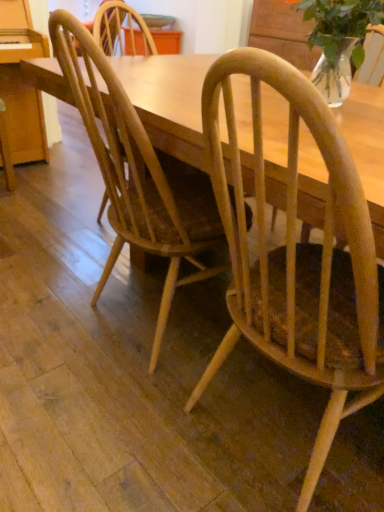
Question: Does natural wood chair at center, which is the 1th chair in left-to-right order, have a greater width compared to light brown wood chair at center, which appears as the 2th chair when viewed from the left?

Choices:
 (A) yes
 (B) no

Answer: (B)

Question: From the image's perspective, would you say natural wood chair at center, marked as the 2th chair in a right-to-left arrangement, is shown under light brown wood chair at center, which is counted as the first chair, starting from the right?

Choices:
 (A) no
 (B) yes

Answer: (A)

Question: Is natural wood chair at center, marked as the 2th chair in a right-to-left arrangement, not close to light brown wood chair at center, which is counted as the first chair, starting from the right?

Choices:
 (A) yes
 (B) no

Answer: (B)

Question: Considering the relative sizes of natural wood chair at center, which is the 1th chair in left-to-right order, and light brown wood chair at center, which is counted as the first chair, starting from the right, in the image provided, is natural wood chair at center, which is the 1th chair in left-to-right order, shorter than light brown wood chair at center, which is counted as the first chair, starting from the right,?

Choices:
 (A) yes
 (B) no

Answer: (A)

Question: Considering the relative positions of natural wood chair at center, marked as the 2th chair in a right-to-left arrangement, and light brown wood chair at center, which is counted as the first chair, starting from the right, in the image provided, is natural wood chair at center, marked as the 2th chair in a right-to-left arrangement, to the right of light brown wood chair at center, which is counted as the first chair, starting from the right, from the viewer's perspective?

Choices:
 (A) no
 (B) yes

Answer: (A)

Question: Is clear glass vase at upper right in front of or behind natural wood chair at center, which is the 1th chair in left-to-right order, in the image?

Choices:
 (A) front
 (B) behind

Answer: (B)

Question: From a real-world perspective, relative to natural wood chair at center, which is the 1th chair in left-to-right order, is clear glass vase at upper right vertically above or below?

Choices:
 (A) above
 (B) below

Answer: (A)

Question: Do you think clear glass vase at upper right is within natural wood chair at center, which is the 1th chair in left-to-right order, or outside of it?

Choices:
 (A) outside
 (B) inside

Answer: (A)

Question: Is clear glass vase at upper right to the left or to the right of natural wood chair at center, marked as the 2th chair in a right-to-left arrangement, in the image?

Choices:
 (A) left
 (B) right

Answer: (B)

Question: From their relative heights in the image, would you say natural wood chair at center, which is the 1th chair in left-to-right order, is taller or shorter than clear glass vase at upper right?

Choices:
 (A) short
 (B) tall

Answer: (B)

Question: Is point tap(56, 44) closer or farther from the camera than point tap(362, 36)?

Choices:
 (A) closer
 (B) farther

Answer: (A)

Question: Considering their positions, is natural wood chair at center, marked as the 2th chair in a right-to-left arrangement, located in front of or behind clear glass vase at upper right?

Choices:
 (A) behind
 (B) front

Answer: (B)

Question: From a real-world perspective, is natural wood chair at center, which is the 1th chair in left-to-right order, above or below clear glass vase at upper right?

Choices:
 (A) above
 (B) below

Answer: (B)

Question: From a real-world perspective, relative to natural wood chair at center, which is the 1th chair in left-to-right order, is light brown wood chair at center, which appears as the 2th chair when viewed from the left, vertically above or below?

Choices:
 (A) above
 (B) below

Answer: (B)

Question: In terms of width, does light brown wood chair at center, which is counted as the first chair, starting from the right, look wider or thinner when compared to natural wood chair at center, which is the 1th chair in left-to-right order?

Choices:
 (A) wide
 (B) thin

Answer: (A)